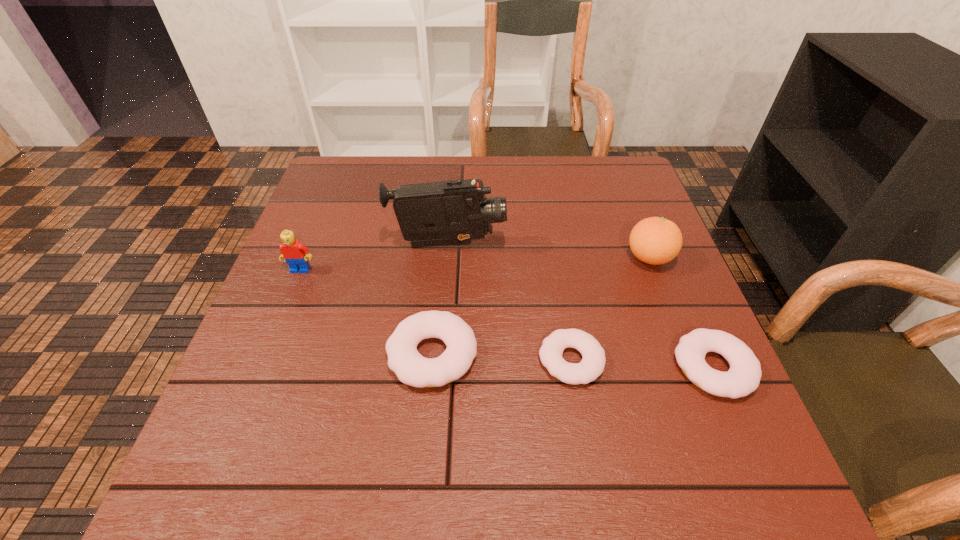
Locate an element on the screen. free space located 0.400m on the back of the second shortest doughnut is located at coordinates (648, 213).

This screenshot has width=960, height=540. I want to click on free space located 0.320m on the front of the orange, so click(x=705, y=403).

At what (x,y) coordinates should I click in order to perform the action: click on free spot located on the front-facing side of the camcorder. Please return your answer as a coordinate pair (x, y). The image size is (960, 540). Looking at the image, I should click on (542, 245).

Identify the location of vacant area situated 0.060m on the face of the Lego. The width and height of the screenshot is (960, 540). (291, 293).

Where is `object that is at the left edge`? The width and height of the screenshot is (960, 540). object that is at the left edge is located at coordinates (295, 254).

Find the location of a particular element. doughnut that is at the right edge is located at coordinates click(743, 377).

Locate an element on the screen. orange that is positioned at the right edge is located at coordinates (654, 240).

At what (x,y) coordinates should I click in order to perform the action: click on object positioned at the near right corner. Please return your answer as a coordinate pair (x, y). This screenshot has width=960, height=540. Looking at the image, I should click on (743, 377).

In order to click on free space at the far edge in this screenshot , I will do `click(518, 189)`.

The width and height of the screenshot is (960, 540). In the image, there is a desktop. What are the coordinates of `free space at the near edge` in the screenshot? It's located at (424, 416).